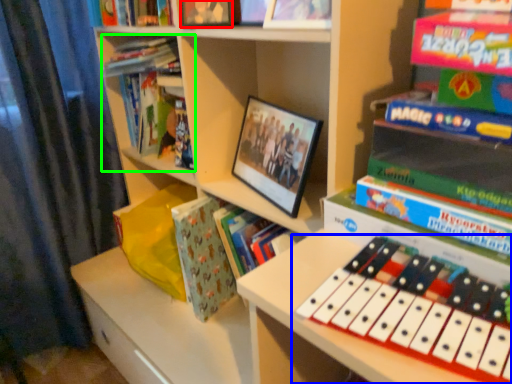
Question: Which object is positioned farthest from book (highlighted by a red box)? Select from musical keyboard (highlighted by a blue box) and book (highlighted by a green box).

Choices:
 (A) musical keyboard
 (B) book

Answer: (A)